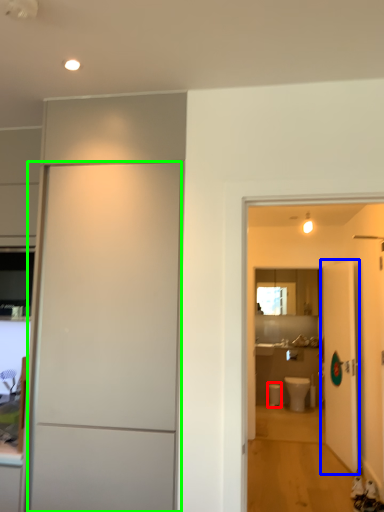
Question: Considering the real-world distances, which object is farthest from toilet bowl (highlighted by a red box)? door (highlighted by a blue box) or door (highlighted by a green box)?

Choices:
 (A) door
 (B) door

Answer: (B)